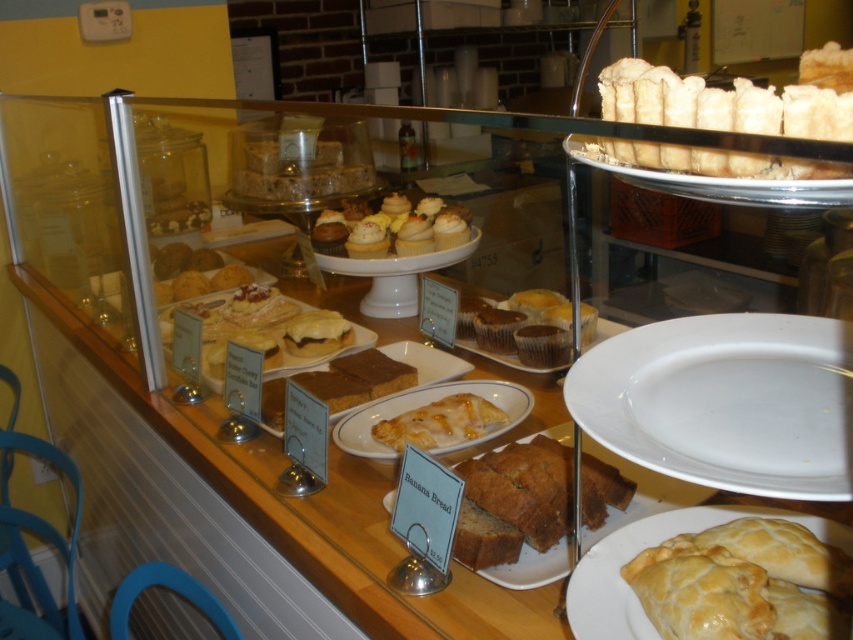
You are a customer standing in front of the bakery display case. You notice two points inside the case, one at point (822, 205) and the other at point (544, 365). Which point is closer to you?

Point (822, 205) is closer to the viewer than point (544, 365).

You are a customer at the bakery and want to place the golden brown flaky pastry at upper right on the white ceramic plate at upper right. Can you determine if the pastry will fit on the plate based on their sizes?

The golden brown flaky pastry at upper right might be wider than white ceramic plate at upper right, so there is a possibility that the pastry will not fit on the plate. It is recommended to check the size of the plate before placing the pastry.